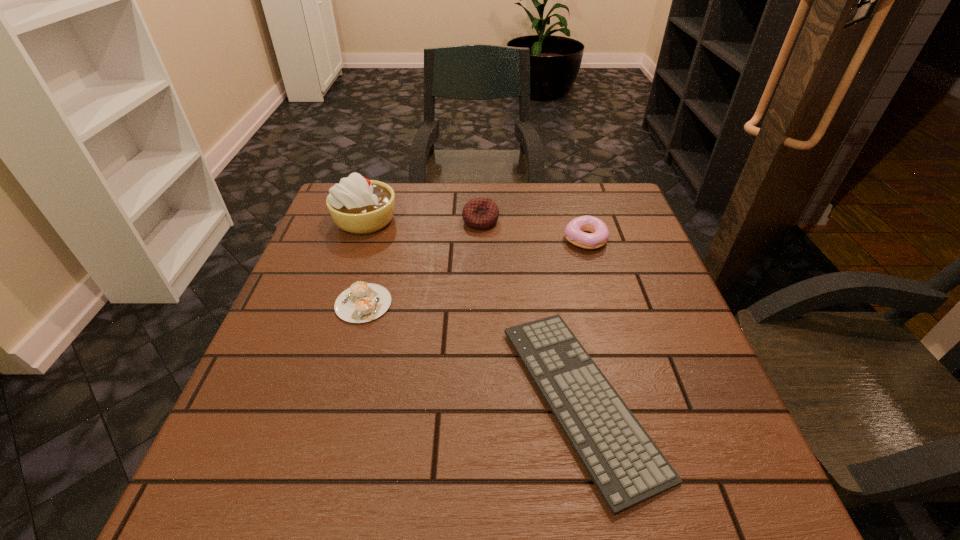
Image resolution: width=960 pixels, height=540 pixels. I want to click on free space in the image that satisfies the following two spatial constraints: 1. on the front side of the tallest object; 2. on the right side of the third shortest object, so click(x=358, y=240).